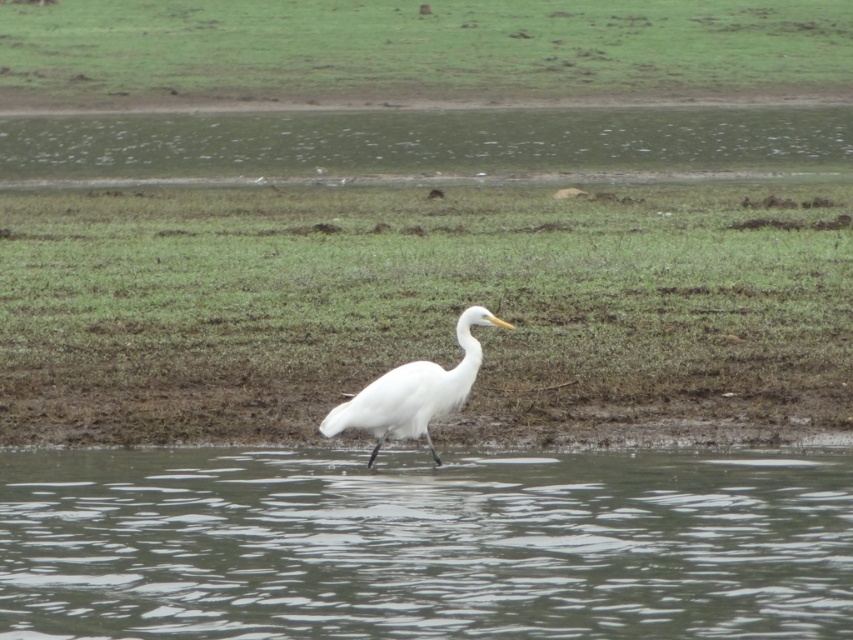
You are a small frog observing the scene from the water. Which of the two green grass areas, the green grass at center or the green grass at upper center, would you consider taller?

The green grass at upper center is taller than the green grass at center.

You are a birdwatcher standing at the edge of the water. You notice two patches of green grass in the scene. How far apart are the green grass at center and the green grass at upper center?

The green grass at center and green grass at upper center are 25.51 meters apart from each other.

Looking at this image, you are standing at the edge of the water and want to walk towards the green grass at center. Which direction should you go relative to the clear water at lower center?

The green grass at center is to the right of the clear water at lower center, so you should walk to the right of the clear water at lower center to reach the green grass at center.